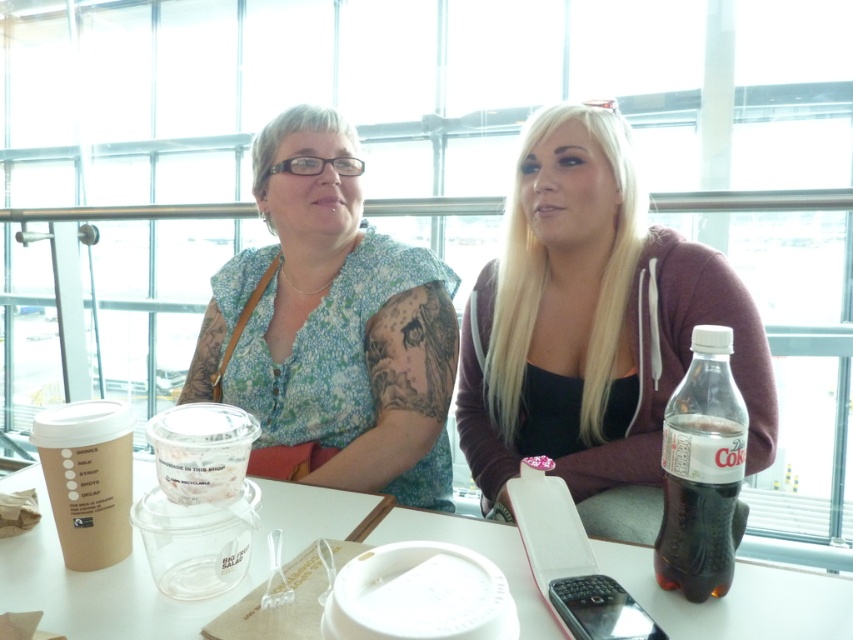
Based on the photo, which of these two, floral fabric blouse at center or clear plastic bottle at right, stands shorter?

Standing shorter between the two is clear plastic bottle at right.

Does floral fabric blouse at center have a lesser height compared to clear plastic bottle at right?

In fact, floral fabric blouse at center may be taller than clear plastic bottle at right.

This screenshot has width=853, height=640. In order to click on floral fabric blouse at center in this screenshot , I will do `click(334, 323)`.

Can you confirm if matte black hoodie at center is thinner than white plastic table at center?

Yes, matte black hoodie at center is thinner than white plastic table at center.

Who is positioned more to the left, matte black hoodie at center or white plastic table at center?

white plastic table at center is more to the left.

Between point (492, 328) and point (93, 577), which one is positioned behind?

Point (492, 328)

This screenshot has width=853, height=640. Identify the location of matte black hoodie at center. (593, 330).

Who is more forward, [698,609] or [49,412]?

Point [698,609] is in front.

Is white plastic table at center smaller than brown paper cup at left?

No.

Describe the element at coordinates (248, 564) in the screenshot. I see `white plastic table at center` at that location.

This screenshot has width=853, height=640. I want to click on white plastic table at center, so click(248, 564).